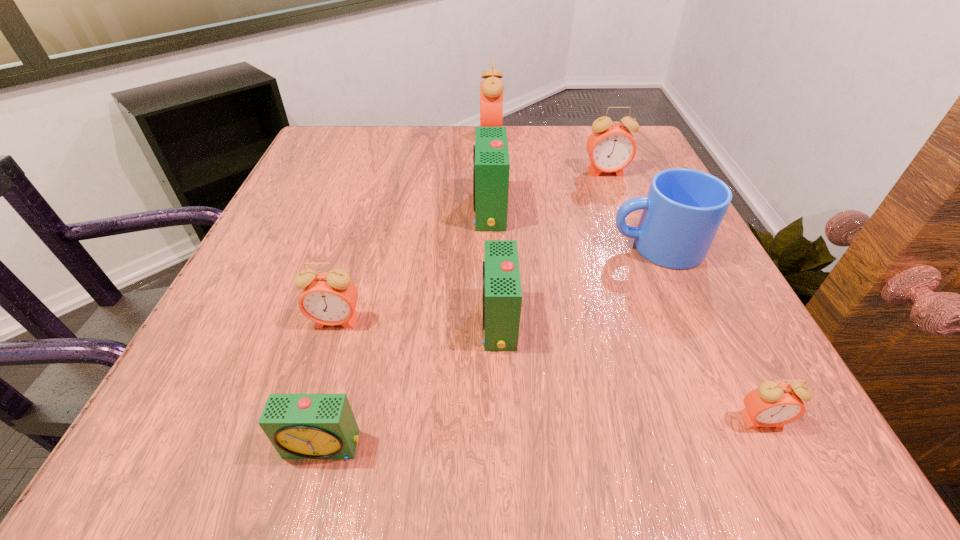
At what (x,y) coordinates should I click in order to perform the action: click on the tallest object. Please return your answer as a coordinate pair (x, y). Looking at the image, I should click on (491, 89).

This screenshot has width=960, height=540. Find the location of `the farthest pink alarm clock`. the farthest pink alarm clock is located at coordinates (491, 89).

Find the location of `the sixth nearest alarm clock`. the sixth nearest alarm clock is located at coordinates (611, 147).

Identify the location of the third smallest pink alarm clock. The image size is (960, 540). (611, 147).

Where is `the biggest green alarm clock`? The width and height of the screenshot is (960, 540). the biggest green alarm clock is located at coordinates (491, 165).

This screenshot has width=960, height=540. Find the location of `the farthest green alarm clock`. the farthest green alarm clock is located at coordinates (491, 165).

Find the location of `mug`. mug is located at coordinates (682, 212).

I want to click on the second smallest pink alarm clock, so click(x=330, y=298).

Find the location of a particular element. This screenshot has height=540, width=960. the leftmost pink alarm clock is located at coordinates (330, 298).

You are a GUI agent. You are given a task and a screenshot of the screen. Output one action in this format:
    pyautogui.click(x=<x>, y=<y>)
    Task: Click on the second biggest green alarm clock
    The height and width of the screenshot is (540, 960).
    Given the screenshot: What is the action you would take?
    pyautogui.click(x=501, y=292)